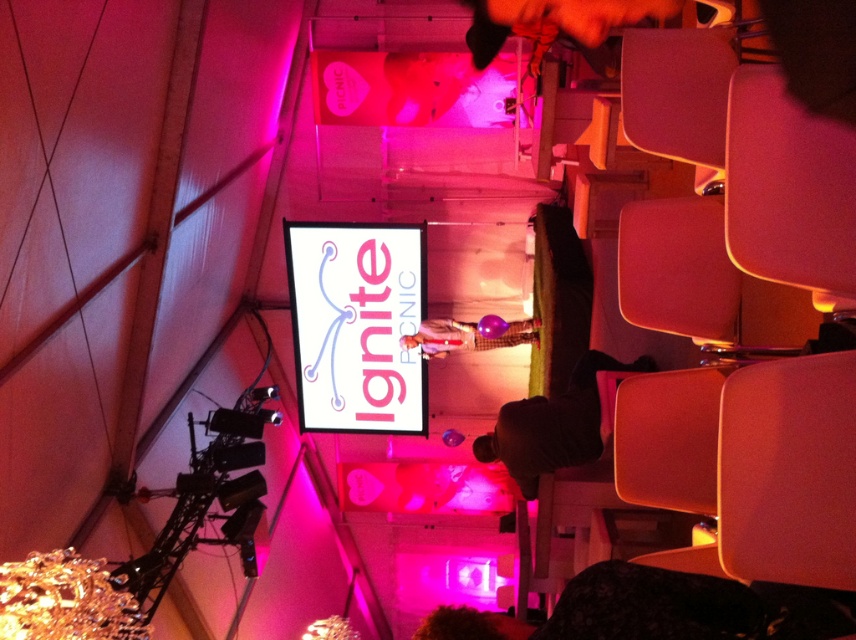
Between white plastic sign at center and dark brown leather jacket at lower center, which one is positioned higher?

Positioned higher is white plastic sign at center.

Does white plastic sign at center have a greater height compared to dark brown leather jacket at lower center?

Yes, white plastic sign at center is taller than dark brown leather jacket at lower center.

Who is more distant from viewer, (308, 272) or (593, 428)?

The point (308, 272) is behind.

Where is `white plastic sign at center`? This screenshot has height=640, width=856. white plastic sign at center is located at coordinates (357, 324).

Based on the photo, can you confirm if dark brown leather jacket at lower center is wider than matte purple balloon at center?

In fact, dark brown leather jacket at lower center might be narrower than matte purple balloon at center.

Between point (536, 481) and point (468, 330), which one is positioned in front?

Point (536, 481) is more forward.

Which is behind, point (535, 429) or point (423, 330)?

The point (423, 330) is behind.

Locate an element on the screen. dark brown leather jacket at lower center is located at coordinates [x=553, y=424].

Is the position of white plastic sign at center more distant than that of matte purple balloon at center?

Yes, white plastic sign at center is behind matte purple balloon at center.

Can you confirm if white plastic sign at center is positioned to the right of matte purple balloon at center?

No, white plastic sign at center is not to the right of matte purple balloon at center.

From the picture: Who is more distant from viewer, (373, 362) or (452, 333)?

The point (373, 362) is behind.

Where is `white plastic sign at center`? This screenshot has width=856, height=640. white plastic sign at center is located at coordinates (357, 324).